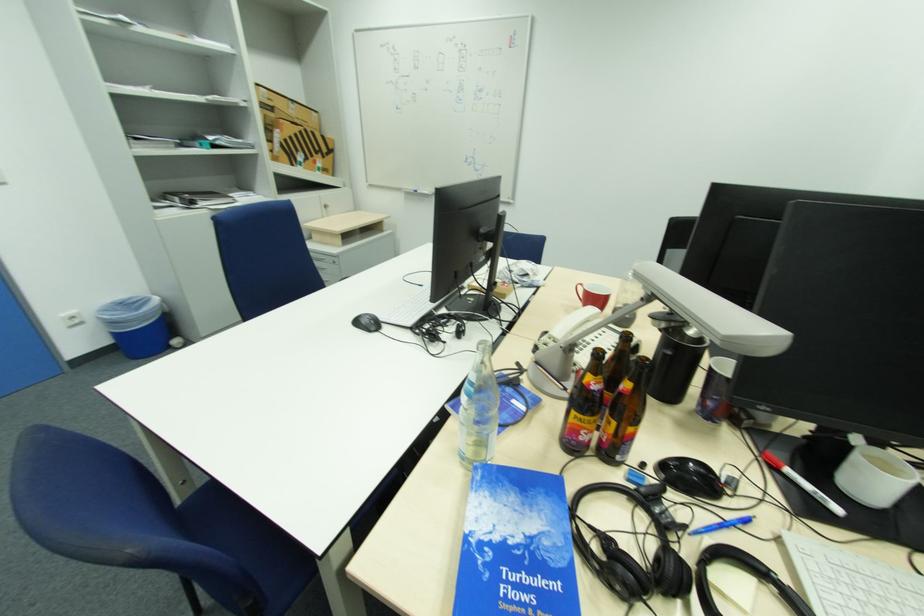
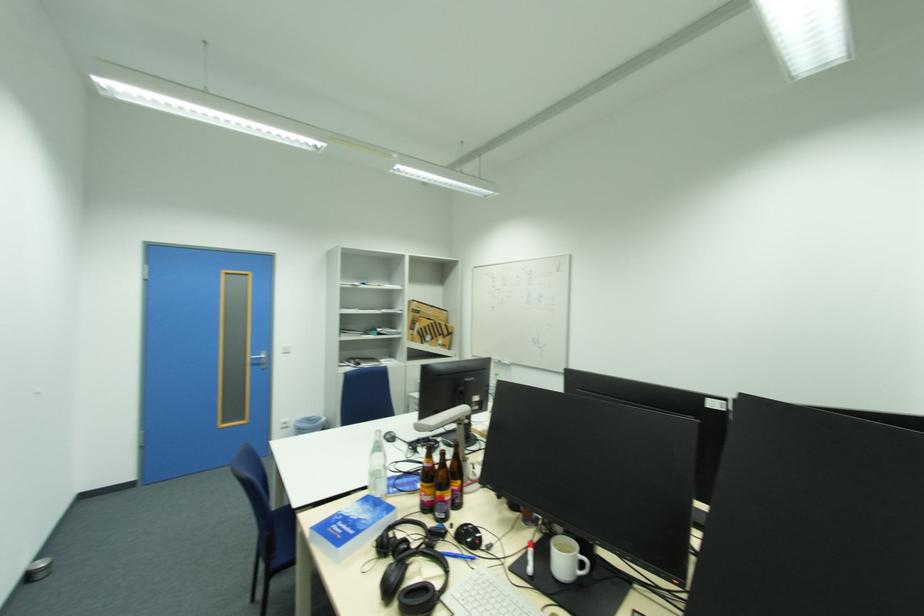
In the second image, find the point that corresponds to point (525, 541) in the first image.

(360, 517)